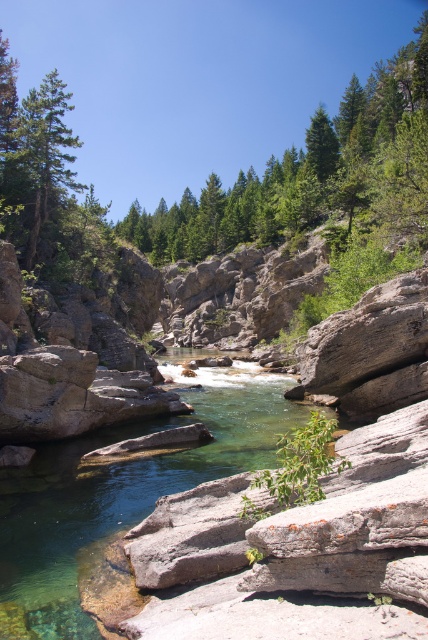
Question: Among these objects, which one is nearest to the camera?

Choices:
 (A) clear stone stream at center
 (B) green matte tree at upper left

Answer: (A)

Question: Among these objects, which one is nearest to the camera?

Choices:
 (A) green matte tree at upper center
 (B) clear stone stream at center
 (C) green matte tree at upper left

Answer: (B)

Question: Can you confirm if clear stone stream at center is thinner than green matte tree at upper center?

Choices:
 (A) no
 (B) yes

Answer: (B)

Question: Where is green matte tree at upper left located in relation to green matte tree at upper center in the image?

Choices:
 (A) left
 (B) right

Answer: (A)

Question: Can you confirm if clear stone stream at center is positioned to the right of green leafy tree at center?

Choices:
 (A) yes
 (B) no

Answer: (B)

Question: Which is nearer to the green matte tree at upper left?

Choices:
 (A) clear stone stream at center
 (B) green leafy tree at center

Answer: (A)